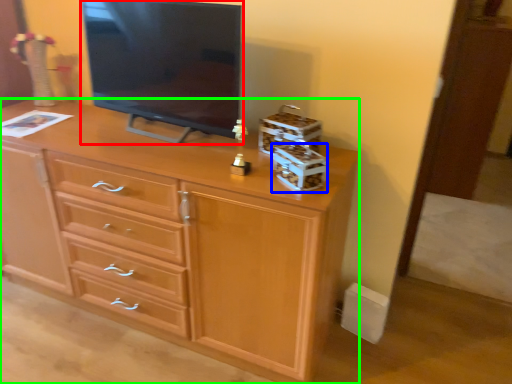
Question: Based on their relative distances, which object is nearer to television (highlighted by a red box)? Choose from storage box (highlighted by a blue box) and chest of drawers (highlighted by a green box).

Choices:
 (A) storage box
 (B) chest of drawers

Answer: (B)